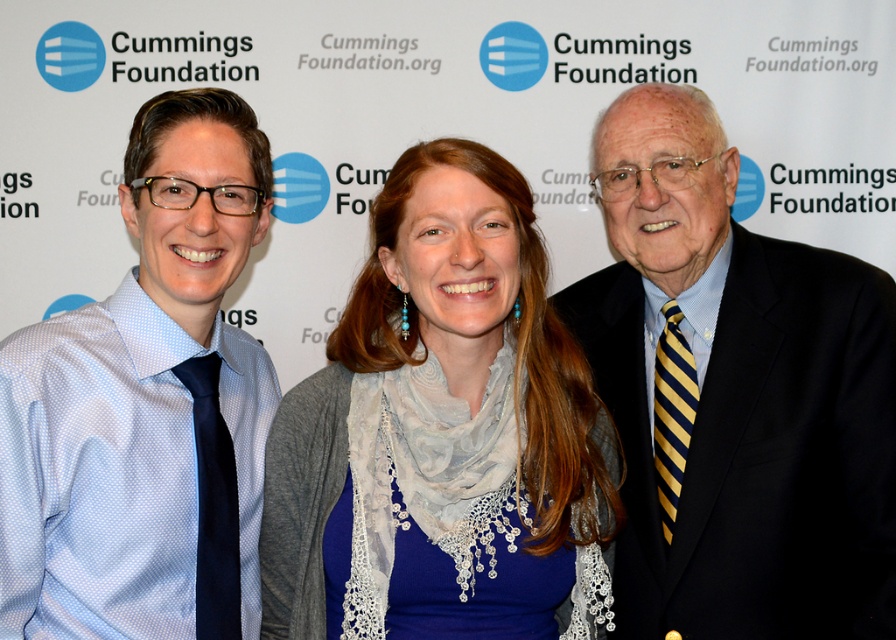
Question: Among these objects, which one is nearest to the camera?

Choices:
 (A) matte blue shirt at left
 (B) black suit at center
 (C) blue lace scarf at center

Answer: (A)

Question: Is black suit at center to the left of matte blue shirt at left from the viewer's perspective?

Choices:
 (A) yes
 (B) no

Answer: (B)

Question: Which point is farther from the camera taking this photo?

Choices:
 (A) (110, 556)
 (B) (478, 250)
 (C) (739, 260)

Answer: (C)

Question: Can you confirm if black suit at center is positioned above matte blue shirt at left?

Choices:
 (A) yes
 (B) no

Answer: (A)

Question: Which object is closer to the camera taking this photo?

Choices:
 (A) blue lace scarf at center
 (B) black suit at center

Answer: (A)

Question: Is black suit at center to the left of blue lace scarf at center from the viewer's perspective?

Choices:
 (A) yes
 (B) no

Answer: (B)